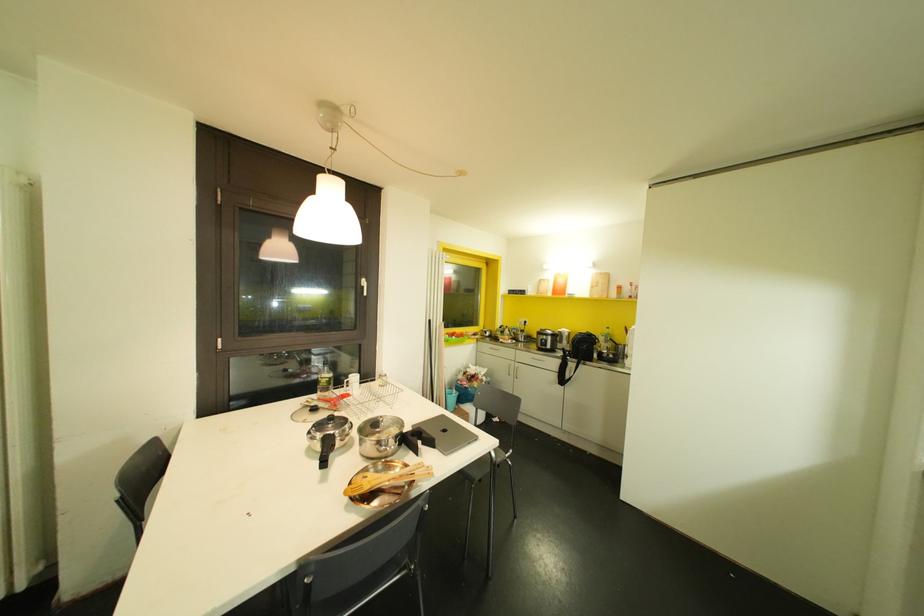
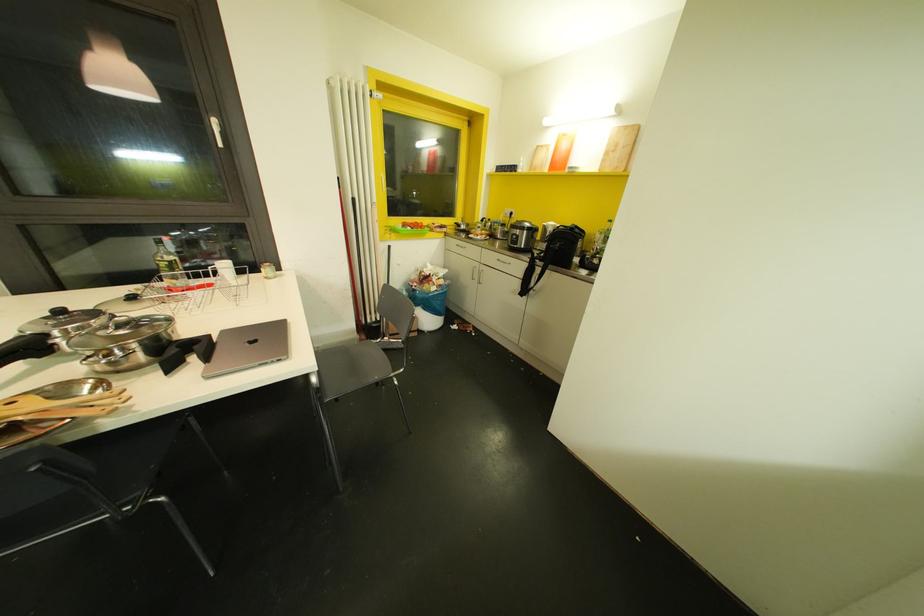
The images are taken continuously from a first-person perspective. In which direction are you moving?

The movement direction of the cameraman is right, forward.